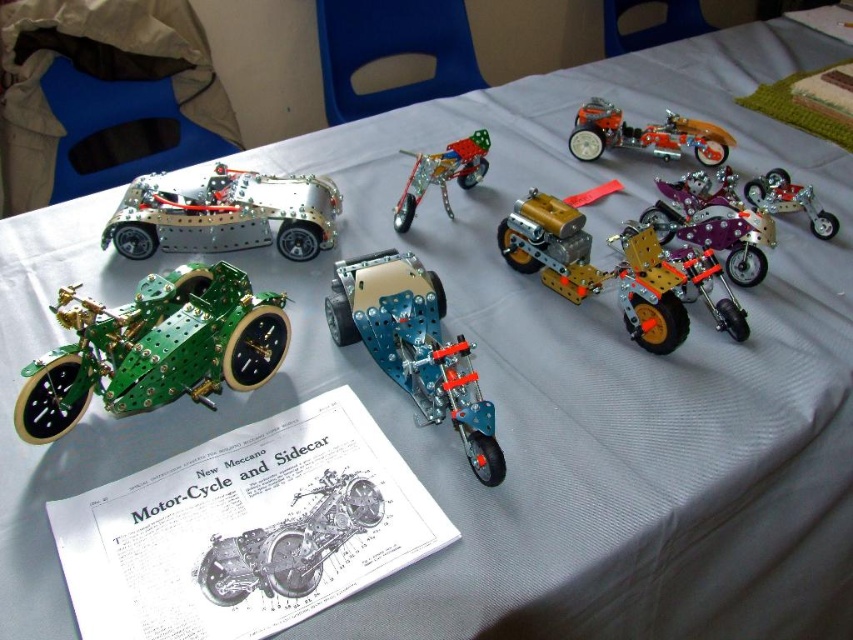
Question: Does translucent blue motorcycle at center appear over brushed metal car at left?

Choices:
 (A) yes
 (B) no

Answer: (B)

Question: Which point is farther from the camera taking this photo?

Choices:
 (A) pyautogui.click(x=705, y=269)
 (B) pyautogui.click(x=706, y=131)

Answer: (B)

Question: Can you confirm if translucent blue motorcycle at center is positioned to the right of shiny silver motorcycle at center?

Choices:
 (A) yes
 (B) no

Answer: (A)

Question: Which object appears closest to the camera in this image?

Choices:
 (A) translucent blue motorcycle at center
 (B) green metallic motorcycle at center-left
 (C) metallic/transparent motorcycle at center
 (D) shiny silver motorcycle at center

Answer: (D)

Question: Can you confirm if translucent blue motorcycle at center is positioned above gold metallic motorcycle at center-right?

Choices:
 (A) yes
 (B) no

Answer: (B)

Question: Which object is farther from the camera taking this photo?

Choices:
 (A) shiny silver motorcycle at center
 (B) green metallic motorcycle at center-left
 (C) orange metallic motorcycle at center

Answer: (C)